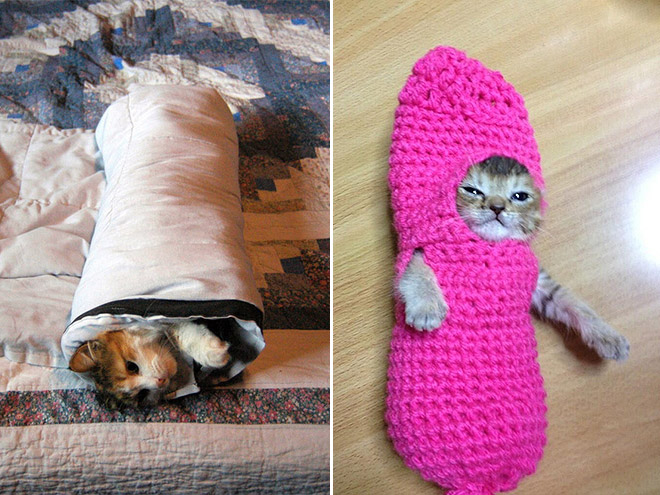
The width and height of the screenshot is (660, 495). Find the location of `blanket`. blanket is located at coordinates (243, 440).